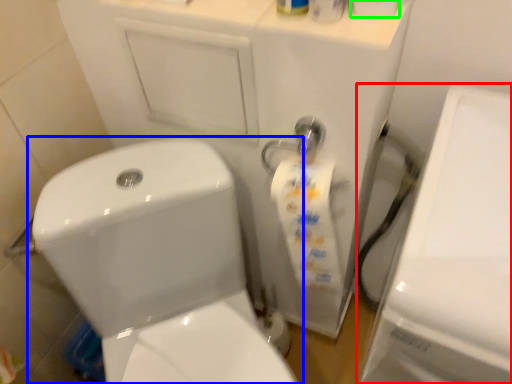
Question: Which is nearer to the porcelain (highlighted by a red box)? toilet (highlighted by a blue box) or toilet paper (highlighted by a green box).

Choices:
 (A) toilet
 (B) toilet paper

Answer: (B)